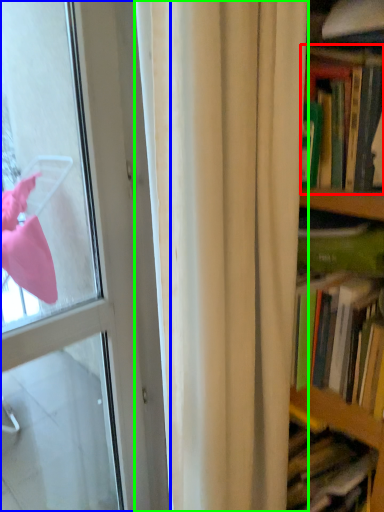
Question: Considering the real-world distances, which object is closest to book (highlighted by a red box)? door (highlighted by a blue box) or curtain (highlighted by a green box).

Choices:
 (A) door
 (B) curtain

Answer: (B)